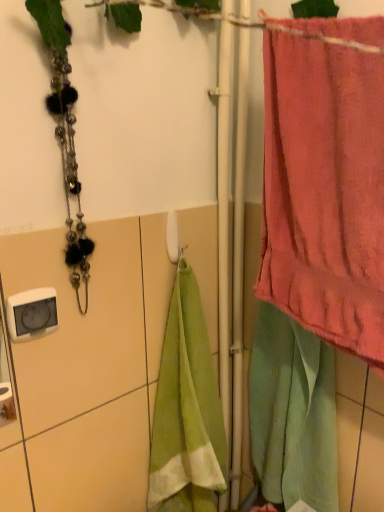
Question: Looking at their shapes, would you say pink terry cloth towel at right is wider or thinner than white plastic towel bar at center?

Choices:
 (A) wide
 (B) thin

Answer: (A)

Question: Looking at the image, does pink terry cloth towel at right seem bigger or smaller compared to white plastic towel bar at center?

Choices:
 (A) small
 (B) big

Answer: (B)

Question: From a real-world perspective, relative to white plastic towel bar at center, is pink terry cloth towel at right vertically above or below?

Choices:
 (A) below
 (B) above

Answer: (B)

Question: Relative to pink terry cloth towel at right, is white plastic towel bar at center in front or behind?

Choices:
 (A) front
 (B) behind

Answer: (B)

Question: Is white plastic towel bar at center situated inside pink terry cloth towel at right or outside?

Choices:
 (A) outside
 (B) inside

Answer: (A)

Question: Does point (177, 229) appear closer or farther from the camera than point (365, 216)?

Choices:
 (A) closer
 (B) farther

Answer: (B)

Question: From the image's perspective, is white plastic towel bar at center located above or below pink terry cloth towel at right?

Choices:
 (A) below
 (B) above

Answer: (A)